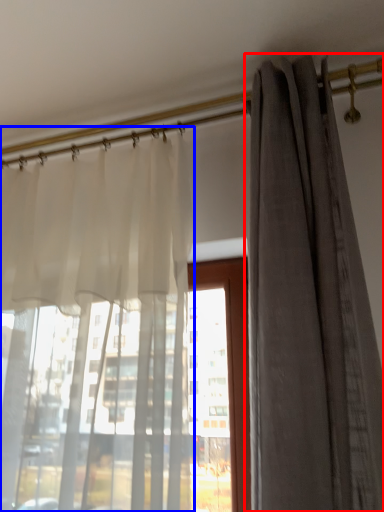
Question: Which object appears closest to the camera in this image, curtain (highlighted by a red box) or curtain (highlighted by a blue box)?

Choices:
 (A) curtain
 (B) curtain

Answer: (A)